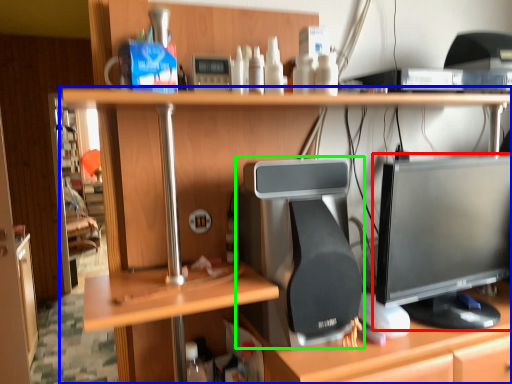
Question: Based on their relative distances, which object is farther from computer monitor (highlighted by a red box)? Choose from desk (highlighted by a blue box) and desktop computer (highlighted by a green box).

Choices:
 (A) desk
 (B) desktop computer

Answer: (A)